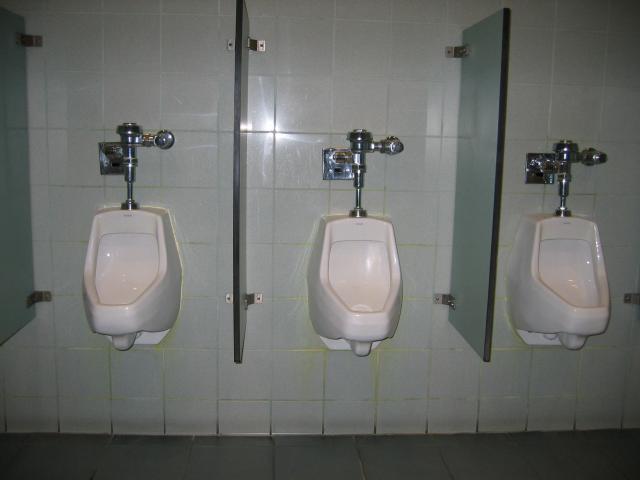
Find the location of a particular element. This screenshot has height=480, width=640. divider bracket is located at coordinates (38, 297), (28, 39), (257, 40), (233, 41), (228, 296), (250, 299), (440, 300), (458, 49), (637, 300).